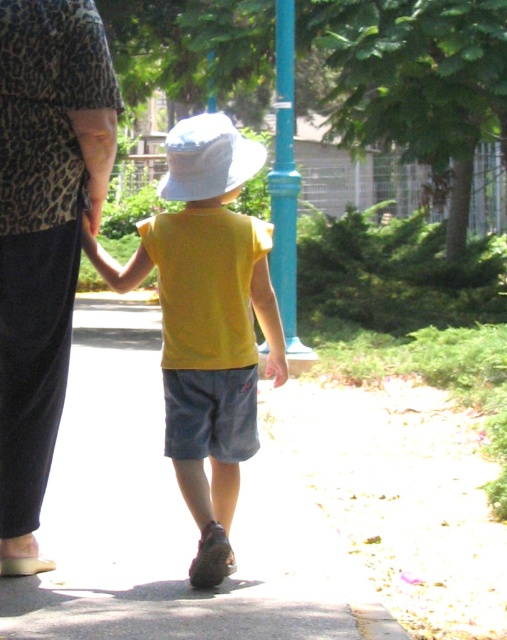
You are a drone operator trying to capture a photo of the gray concrete pavement at center and the white matte hat at center from above. Which object should you focus on first if you want to ensure both are in focus without adjusting the camera settings?

The gray concrete pavement at center is shorter than the white matte hat at center, so you should focus on the white matte hat at center first. This ensures that the shorter pavement will still be within the depth of field since it is closer to the camera than the taller hat.

You are a drone operator trying to capture a photo of the gray concrete pavement at center and the yellow matte shirt at center. From the camera view, which object appears to be on the right side?

The yellow matte shirt at center is on the right side of the gray concrete pavement at center, so in the camera view, the yellow matte shirt at center appears to be on the right side.

You are a photographer standing at the edge of the path. You want to take a photo of the yellow matte shirt at center and the white matte hat at center so that both are clearly visible. Given that your camera has a maximum focus range of 5 feet, will you be able to capture both objects in focus?

The yellow matte shirt at center is 4.64 feet from the white matte hat at center. Since the distance between them is within the camera maximum focus range of 5 feet, both objects can be captured in focus.